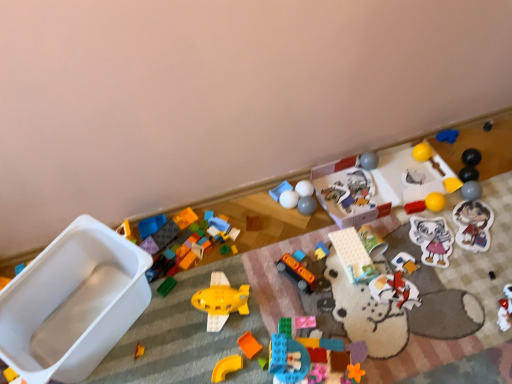
Where is `free location to the right of yellow plastic curve at center, the fifth toy in the left-to-right sequence`? free location to the right of yellow plastic curve at center, the fifth toy in the left-to-right sequence is located at coordinates (265, 345).